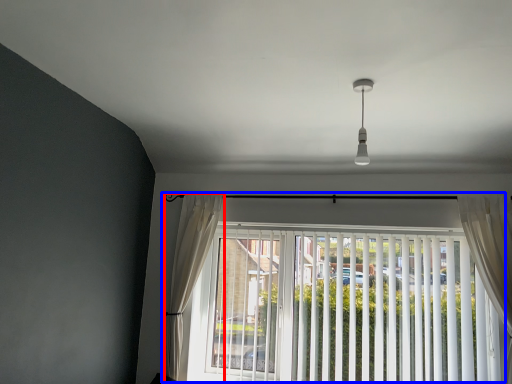
Question: Which point is further to the camera, curtain (highlighted by a red box) or window (highlighted by a blue box)?

Choices:
 (A) curtain
 (B) window

Answer: (A)